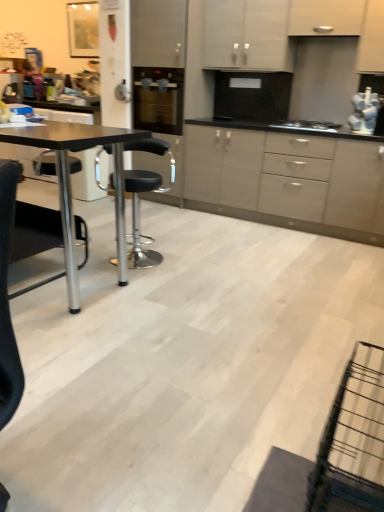
Question: Is the depth of black leather stool at center greater than that of white matte cabinet at upper center, which is counted as the third cabinetry, starting from the bottom?

Choices:
 (A) no
 (B) yes

Answer: (A)

Question: Is the position of black leather stool at center less distant than that of white matte cabinet at upper center, which is counted as the third cabinetry, starting from the bottom?

Choices:
 (A) yes
 (B) no

Answer: (A)

Question: Is black leather stool at center next to white matte cabinet at upper center, which is counted as the first cabinetry, starting from the top?

Choices:
 (A) yes
 (B) no

Answer: (B)

Question: From a real-world perspective, does black leather stool at center sit lower than white matte cabinet at upper center, which is counted as the first cabinetry, starting from the top?

Choices:
 (A) yes
 (B) no

Answer: (A)

Question: Considering the relative sizes of black leather stool at center and white matte cabinet at upper center, which is counted as the first cabinetry, starting from the top, in the image provided, is black leather stool at center bigger than white matte cabinet at upper center, which is counted as the first cabinetry, starting from the top,?

Choices:
 (A) yes
 (B) no

Answer: (A)

Question: Considering the relative sizes of black leather stool at center and white matte cabinet at upper center, which is counted as the first cabinetry, starting from the top, in the image provided, is black leather stool at center taller than white matte cabinet at upper center, which is counted as the first cabinetry, starting from the top,?

Choices:
 (A) yes
 (B) no

Answer: (A)

Question: Is black glass oven at center to the left of white matte cabinet at upper center, which is counted as the second cabinetry, starting from the bottom, from the viewer's perspective?

Choices:
 (A) yes
 (B) no

Answer: (A)

Question: From a real-world perspective, is black glass oven at center located beneath white matte cabinet at upper center, which is the 2th cabinetry in top-to-bottom order?

Choices:
 (A) yes
 (B) no

Answer: (A)

Question: Is black glass oven at center bigger than white matte cabinet at upper center, which is counted as the second cabinetry, starting from the bottom?

Choices:
 (A) yes
 (B) no

Answer: (A)

Question: Does black glass oven at center have a greater width compared to white matte cabinet at upper center, which is counted as the second cabinetry, starting from the bottom?

Choices:
 (A) no
 (B) yes

Answer: (B)

Question: Considering the relative sizes of black glass oven at center and white matte cabinet at upper center, which is counted as the second cabinetry, starting from the bottom, in the image provided, is black glass oven at center smaller than white matte cabinet at upper center, which is counted as the second cabinetry, starting from the bottom,?

Choices:
 (A) no
 (B) yes

Answer: (A)

Question: Is black glass oven at center beside white matte cabinet at upper center, which is the 2th cabinetry in top-to-bottom order?

Choices:
 (A) yes
 (B) no

Answer: (B)

Question: Considering the relative sizes of black matte table at left and black leather stool at center in the image provided, is black matte table at left bigger than black leather stool at center?

Choices:
 (A) no
 (B) yes

Answer: (B)